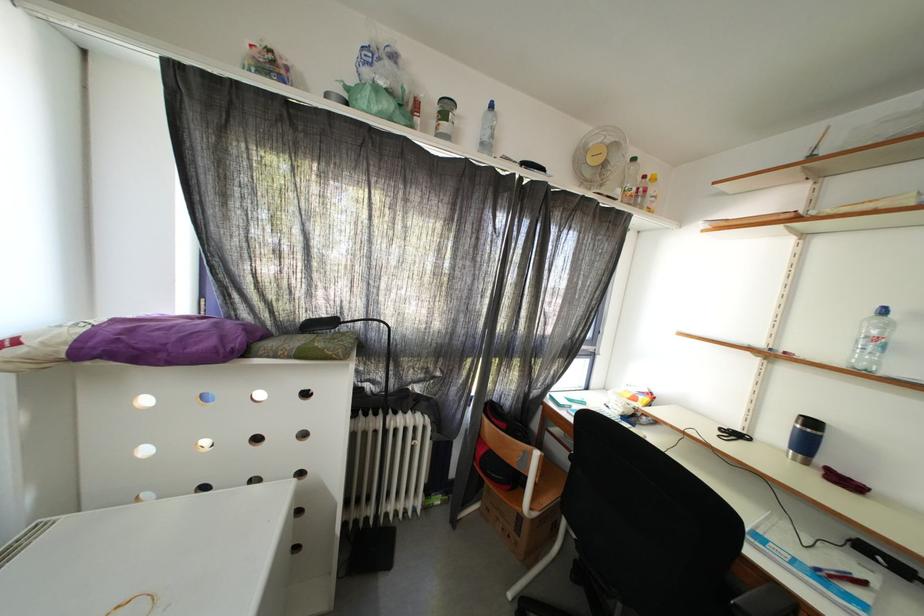
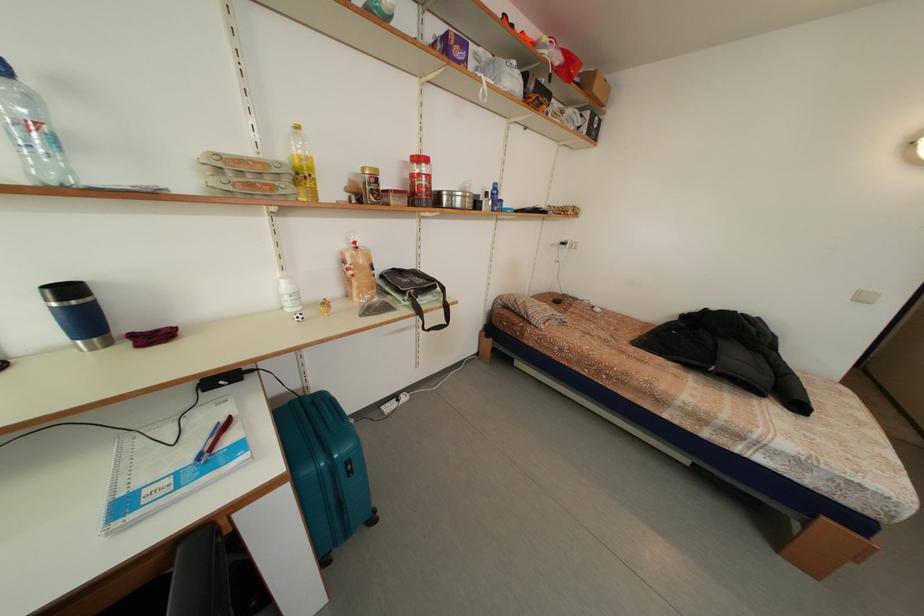
The point at (x=820, y=429) is marked in the first image. Where is the corresponding point in the second image?

(78, 296)